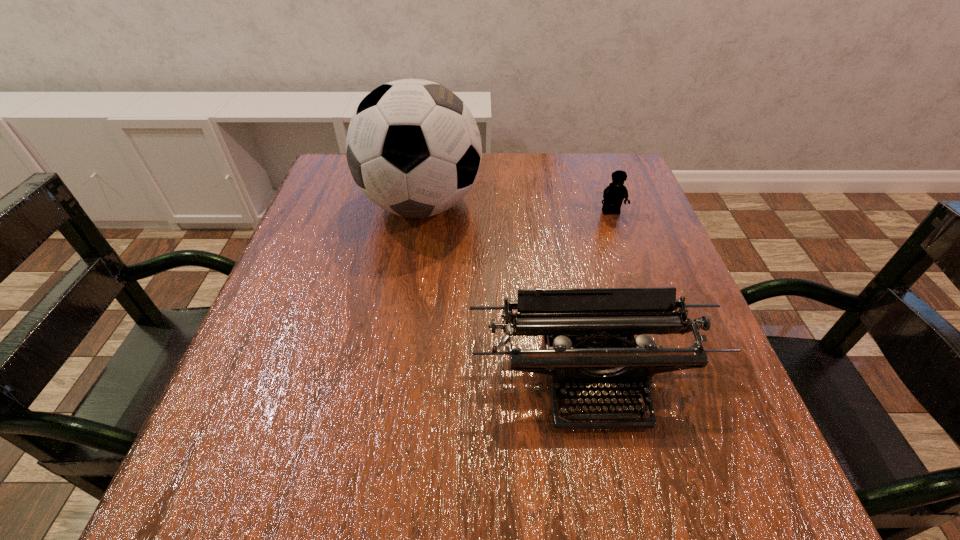
The height and width of the screenshot is (540, 960). I want to click on the tallest object, so click(413, 147).

The image size is (960, 540). What are the coordinates of `typewriter` in the screenshot? It's located at (586, 332).

I want to click on the second tallest object, so click(x=586, y=332).

Image resolution: width=960 pixels, height=540 pixels. In order to click on Lego in this screenshot , I will do `click(614, 194)`.

In order to click on vacant space located on the main logo of the soccer ball in this screenshot , I will do `click(533, 205)`.

At what (x,y) coordinates should I click in order to perform the action: click on vacant space located 0.100m on the typing side of the nearest object. Please return your answer as a coordinate pair (x, y). The width and height of the screenshot is (960, 540). Looking at the image, I should click on (618, 506).

Identify the location of free spot located on the front-facing side of the Lego. The height and width of the screenshot is (540, 960). (626, 256).

You are a GUI agent. You are given a task and a screenshot of the screen. Output one action in this format:
    pyautogui.click(x=<x>, y=<y>)
    Task: Click on the object present at the far edge
    The height and width of the screenshot is (540, 960).
    Given the screenshot: What is the action you would take?
    pyautogui.click(x=413, y=147)

Identify the location of object located in the left edge section of the desktop. (413, 147).

Locate an element on the screen. The image size is (960, 540). typewriter at the right edge is located at coordinates (586, 332).